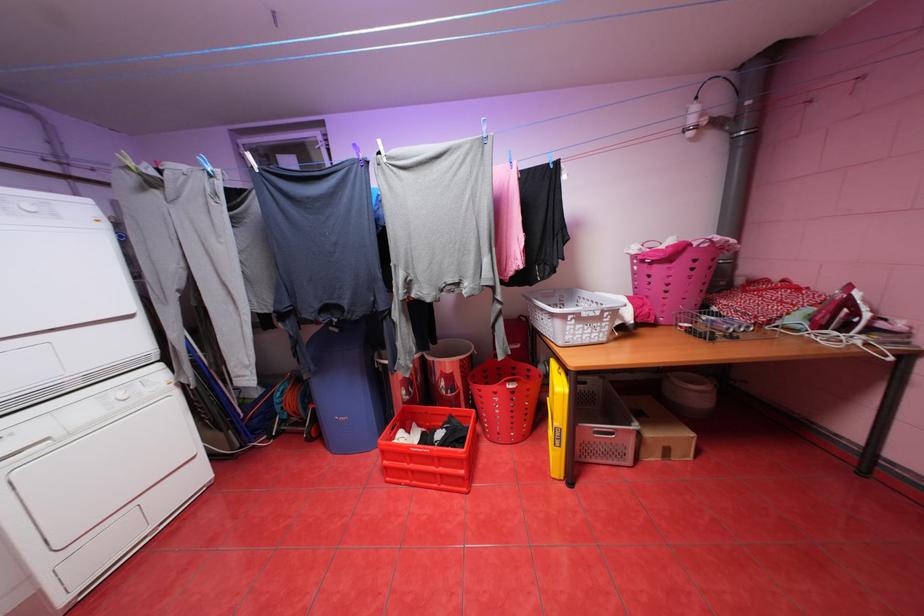
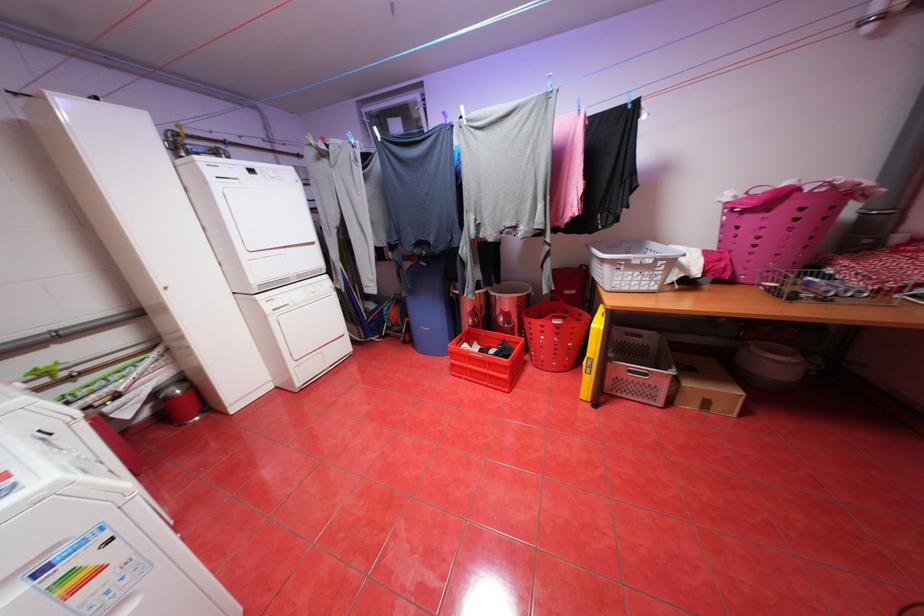
Find the pixel in the second image that matches point (138, 167) in the first image.

(320, 145)